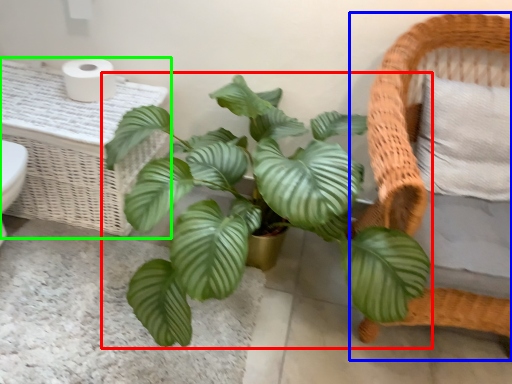
Question: Based on their relative distances, which object is nearer to houseplant (highlighted by a red box)? Choose from furniture (highlighted by a blue box) and table (highlighted by a green box).

Choices:
 (A) furniture
 (B) table

Answer: (A)